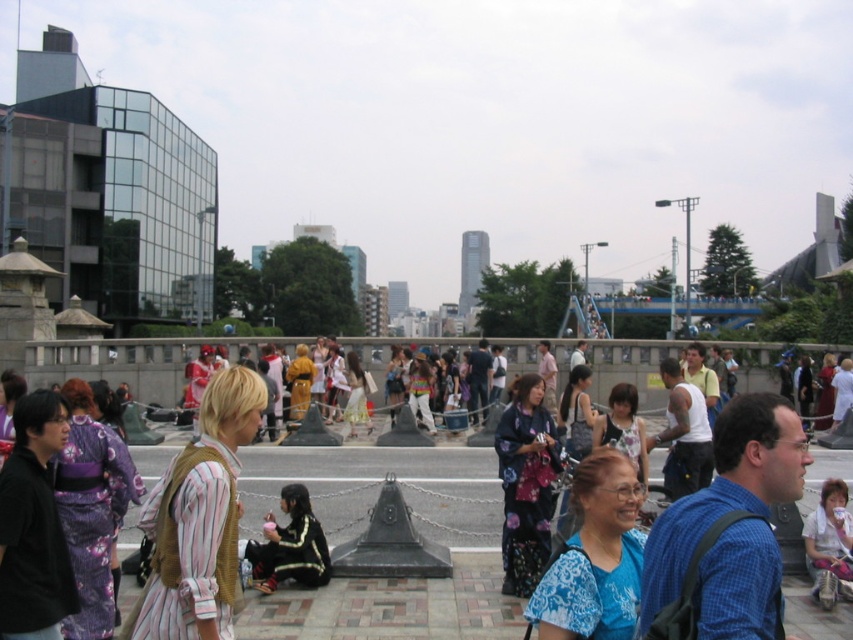
In the scene shown: Does blue floral blouse at center have a lesser height compared to white lace dress at center?

Yes, blue floral blouse at center is shorter than white lace dress at center.

Who is higher up, blue floral blouse at center or white lace dress at center?

Positioned higher is blue floral blouse at center.

Does point (581, 632) come in front of point (364, 412)?

Yes, point (581, 632) is closer to viewer.

The image size is (853, 640). I want to click on blue floral blouse at center, so click(595, 557).

Can you confirm if purple silk kimono at left is taller than white cotton shirt at lower right?

Yes, purple silk kimono at left is taller than white cotton shirt at lower right.

Who is positioned more to the right, purple silk kimono at left or white cotton shirt at lower right?

Positioned to the right is white cotton shirt at lower right.

Where is `purple silk kimono at left`? purple silk kimono at left is located at coordinates (91, 509).

Where is `purple silk kimono at left`? This screenshot has width=853, height=640. purple silk kimono at left is located at coordinates (91, 509).

Who is shorter, white cotton shirt at lower right or white lace dress at center?

white cotton shirt at lower right

Is point (851, 596) behind point (351, 384)?

That is False.

Describe the element at coordinates (828, 545) in the screenshot. Image resolution: width=853 pixels, height=640 pixels. I see `white cotton shirt at lower right` at that location.

You are a GUI agent. You are given a task and a screenshot of the screen. Output one action in this format:
    pyautogui.click(x=<x>, y=<y>)
    Task: Click on the white cotton shirt at lower right
    
    Given the screenshot: What is the action you would take?
    pyautogui.click(x=828, y=545)